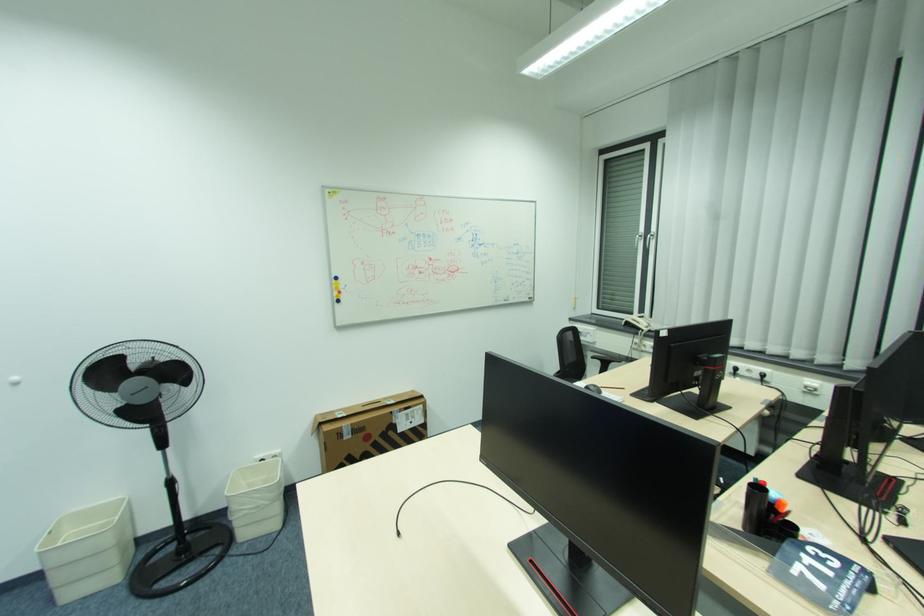
Describe the element at coordinates (650, 238) in the screenshot. This screenshot has height=616, width=924. I see `a silver window handle` at that location.